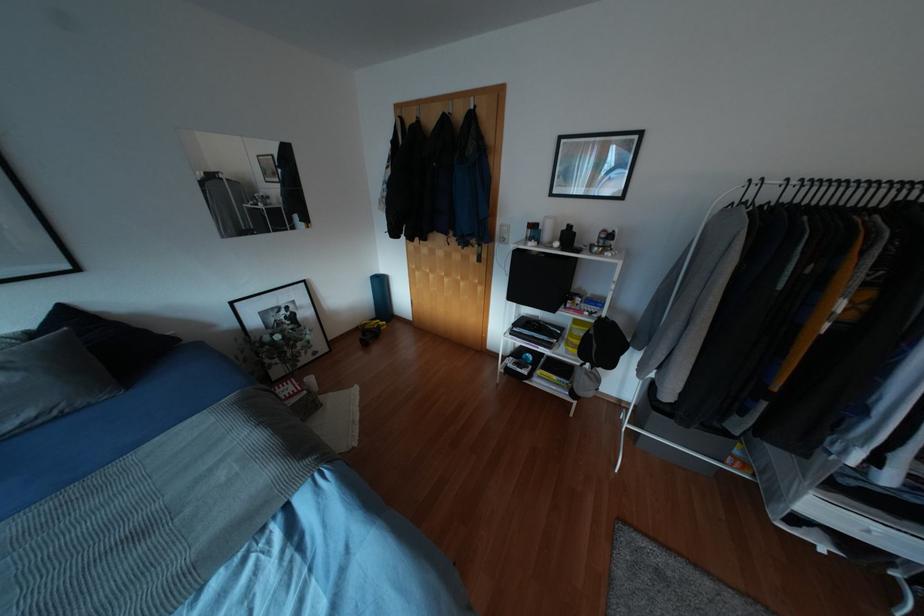
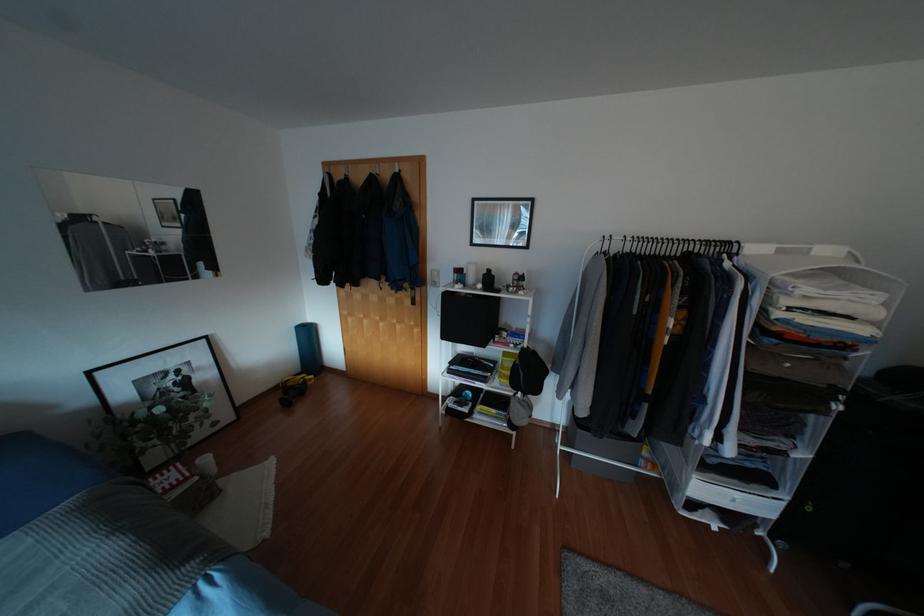
Where in the second image is the point corresponding to (x=310, y=379) from the first image?

(205, 459)